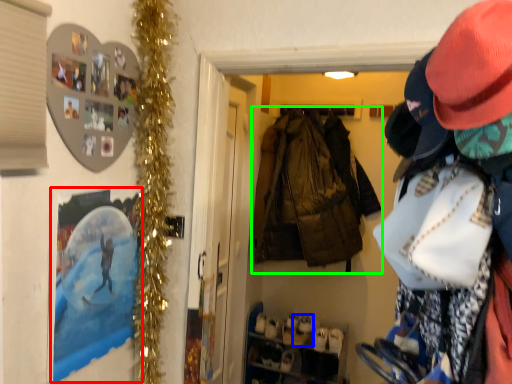
Question: Which object is positioned closest to picture frame (highlighted by a red box)? Select from shoe (highlighted by a blue box) and jacket (highlighted by a green box).

Choices:
 (A) shoe
 (B) jacket

Answer: (B)